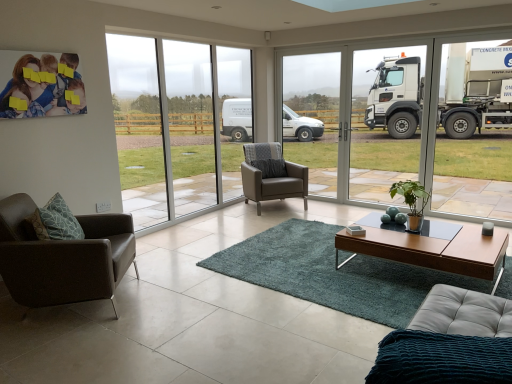
The width and height of the screenshot is (512, 384). What are the coordinates of `leather studio couch at lower right` in the screenshot? It's located at (449, 342).

What do you see at coordinates (410, 234) in the screenshot? I see `translucent glass table at center` at bounding box center [410, 234].

Where is `teal shaggy rug at center`? Image resolution: width=512 pixels, height=384 pixels. teal shaggy rug at center is located at coordinates (333, 273).

Describe the element at coordinates (333, 273) in the screenshot. I see `teal shaggy rug at center` at that location.

I want to click on leather armchair at center, the 1th chair positioned from the back, so click(x=271, y=175).

The width and height of the screenshot is (512, 384). What do you see at coordinates (385, 120) in the screenshot?
I see `transparent glass window at center, marked as the second window frame in a left-to-right arrangement` at bounding box center [385, 120].

You are a GUI agent. You are given a task and a screenshot of the screen. Output one action in this format:
    pyautogui.click(x=<x>, y=<y>)
    Task: Click on the transparent glass window at center
    
    Given the screenshot: What is the action you would take?
    pyautogui.click(x=200, y=121)

Image resolution: width=512 pixels, height=384 pixels. What do you see at coordinates (200, 121) in the screenshot?
I see `transparent glass window at center` at bounding box center [200, 121].

What are the coordinates of `leather studio couch at lower right` in the screenshot? It's located at (449, 342).

From a real-world perspective, which object stands above the other?

clear glass door at center, arranged as the 1th window frame when viewed from the left, from a real-world perspective.

From a real-world perspective, which window frame is the 1st one above the green matte plant at center? Please provide its 2D coordinates.

[(313, 117)]

From the image's perspective, is green matte plant at center beneath clear glass door at center, arranged as the 1th window frame when viewed from the left?

Indeed, from the image's perspective, green matte plant at center is shown beneath clear glass door at center, arranged as the 1th window frame when viewed from the left.

Between green matte plant at center and clear glass door at center, the 2th window frame in the right-to-left sequence, which one appears on the right side from the viewer's perspective?

green matte plant at center.

In the scene shown: Which is more to the left, transparent glass window at center or translucent glass table at center?

transparent glass window at center is more to the left.

In terms of height, does transparent glass window at center look taller or shorter compared to translucent glass table at center?

In the image, transparent glass window at center appears to be taller than translucent glass table at center.

From the image's perspective, which object appears higher, transparent glass window at center or translucent glass table at center?

transparent glass window at center, from the image's perspective.

Is there a large distance between green matte plant at center and brown leather chair at lower left, which is the 1th chair in left-to-right order?

green matte plant at center is far away from brown leather chair at lower left, which is the 1th chair in left-to-right order.

Considering the sizes of objects green matte plant at center and brown leather chair at lower left, the second chair in the right-to-left sequence, in the image provided, who is thinner, green matte plant at center or brown leather chair at lower left, the second chair in the right-to-left sequence,?

With smaller width is green matte plant at center.

Who is bigger, green matte plant at center or brown leather chair at lower left, the second chair in the right-to-left sequence?

brown leather chair at lower left, the second chair in the right-to-left sequence.

Consider the image. In terms of height, does green matte plant at center look taller or shorter compared to brown leather chair at lower left, which is the 1th chair in left-to-right order?

Considering their sizes, green matte plant at center has less height than brown leather chair at lower left, which is the 1th chair in left-to-right order.

Is point (249, 248) closer to viewer compared to point (314, 170)?

Yes, point (249, 248) is closer to viewer.

How different are the orientations of teal shaggy rug at center and clear glass door at center, the 2th window frame in the right-to-left sequence, in degrees?

The angle between the facing direction of teal shaggy rug at center and the facing direction of clear glass door at center, the 2th window frame in the right-to-left sequence, is 0.687 degrees.

Is teal shaggy rug at center further to camera compared to clear glass door at center, the 2th window frame in the right-to-left sequence?

No, the depth of teal shaggy rug at center is less than that of clear glass door at center, the 2th window frame in the right-to-left sequence.

Between teal shaggy rug at center and clear glass door at center, the 2th window frame in the right-to-left sequence, which one has larger size?

teal shaggy rug at center.

Which is more to the right, leather studio couch at lower right or translucent glass table at center?

Positioned to the right is translucent glass table at center.

Is leather studio couch at lower right positioned with its back to translucent glass table at center?

leather studio couch at lower right is not turned away from translucent glass table at center.

In order to click on studio couch in front of the translucent glass table at center in this screenshot , I will do `click(449, 342)`.

Are transparent glass window at center, the first window frame in the right-to-left sequence, and leather armchair at center, positioned as the 2th chair in front-to-back order, making contact?

No.

Consider the image. From the image's perspective, is transparent glass window at center, the first window frame in the right-to-left sequence, on top of leather armchair at center, which ranks as the second chair in left-to-right order?

Correct, transparent glass window at center, the first window frame in the right-to-left sequence, appears higher than leather armchair at center, which ranks as the second chair in left-to-right order, in the image.

Is transparent glass window at center, the first window frame in the right-to-left sequence, behind leather armchair at center, the 1th chair positioned from the back?

No, the depth of transparent glass window at center, the first window frame in the right-to-left sequence, is less than that of leather armchair at center, the 1th chair positioned from the back.

In the scene shown: From a real-world perspective, between transparent glass window at center, marked as the second window frame in a left-to-right arrangement, and leather armchair at center, which appears as the 1th chair when viewed from the right, who is vertically higher?

transparent glass window at center, marked as the second window frame in a left-to-right arrangement.

Based on their sizes in the image, would you say brown leather chair at lower left, arranged as the first chair when viewed from the front, is bigger or smaller than leather studio couch at lower right?

brown leather chair at lower left, arranged as the first chair when viewed from the front, is bigger than leather studio couch at lower right.

In the image, is brown leather chair at lower left, the second chair in the right-to-left sequence, on the left side or the right side of leather studio couch at lower right?

Clearly, brown leather chair at lower left, the second chair in the right-to-left sequence, is on the left of leather studio couch at lower right in the image.

What's the angular difference between brown leather chair at lower left, arranged as the first chair when viewed from the front, and leather studio couch at lower right's facing directions?

173 degrees separate the facing orientations of brown leather chair at lower left, arranged as the first chair when viewed from the front, and leather studio couch at lower right.

The image size is (512, 384). Find the location of `window frame on the left of green matte plant at center`. window frame on the left of green matte plant at center is located at coordinates (313, 117).

Identify the location of glass table beneath the transparent glass window at center (from a real-world perspective). This screenshot has width=512, height=384. (410, 234).

Based on their spatial positions, is brown leather chair at lower left, which is the second chair from back to front, or green matte plant at center further from leather armchair at center, the 1th chair positioned from the back?

The object further to leather armchair at center, the 1th chair positioned from the back, is brown leather chair at lower left, which is the second chair from back to front.

Based on their spatial positions, is transparent glass window at center or wooden glossy coffee table at center further from leather armchair at center, positioned as the 2th chair in front-to-back order?

wooden glossy coffee table at center.

Which object lies further to the anchor point brown leather chair at lower left, which is the 1th chair in left-to-right order, green matte plant at center or transparent glass window at center?

green matte plant at center.

When comparing their distances from wooden glossy coffee table at center, does translucent glass table at center or transparent glass window at center seem closer?

translucent glass table at center.

Which object lies nearer to the anchor point leather armchair at center, which appears as the 1th chair when viewed from the right, brown leather chair at lower left, which is the second chair from back to front, or wooden glossy coffee table at center?

wooden glossy coffee table at center.

Looking at the image, which one is located further to translucent glass table at center, green matte plant at center or transparent glass window at center?

Among the two, transparent glass window at center is located further to translucent glass table at center.

When comparing their distances from brown leather chair at lower left, arranged as the first chair when viewed from the front, does green matte plant at center or teal shaggy rug at center seem further?

The object further to brown leather chair at lower left, arranged as the first chair when viewed from the front, is green matte plant at center.

Which object lies further to the anchor point transparent glass window at center, the first window frame in the right-to-left sequence, wooden glossy coffee table at center or translucent glass table at center?

The object further to transparent glass window at center, the first window frame in the right-to-left sequence, is translucent glass table at center.

The height and width of the screenshot is (384, 512). I want to click on coffee table between leather studio couch at lower right and transparent glass window at center in the front-back direction, so click(431, 247).

You are a GUI agent. You are given a task and a screenshot of the screen. Output one action in this format:
    pyautogui.click(x=<x>, y=<y>)
    Task: Click on the window between brown leather chair at lower left, arranged as the first chair when viewed from the front, and leather armchair at center, the 1th chair positioned from the back, from front to back
    This screenshot has width=512, height=384.
    Given the screenshot: What is the action you would take?
    pyautogui.click(x=200, y=121)

Identify the location of glass table between leather studio couch at lower right and clear glass door at center, the 2th window frame in the right-to-left sequence, from front to back. (410, 234).

I want to click on glass table located between wooden glossy coffee table at center and leather armchair at center, positioned as the 2th chair in front-to-back order, in the depth direction, so click(x=410, y=234).